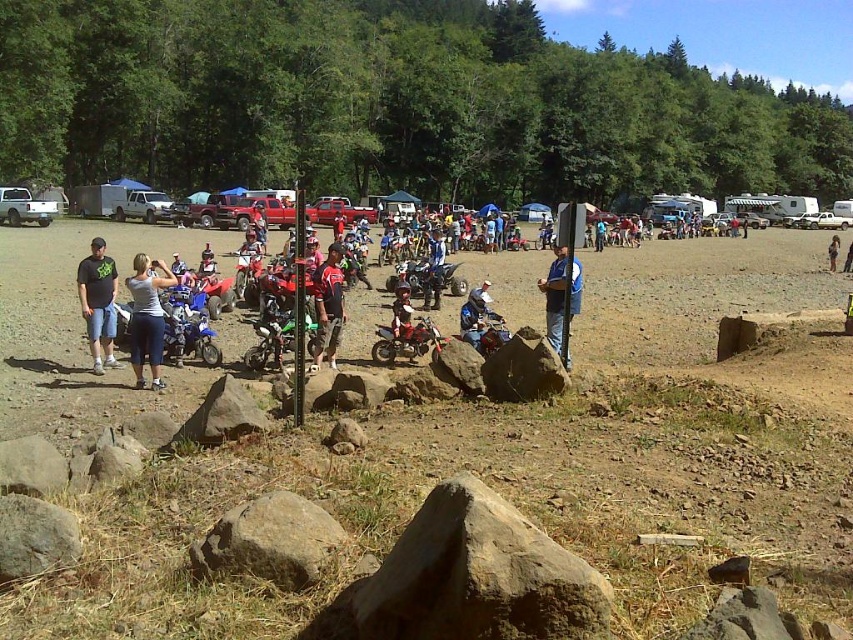
Is point (201, 307) farther from viewer compared to point (242, 244)?

No, it is not.

Does blue metallic motorcycle at center have a greater width compared to matte black motorcycle at center?

No, blue metallic motorcycle at center is not wider than matte black motorcycle at center.

Who is more distant from viewer, (207, 332) or (254, 289)?

The point (254, 289) is more distant.

At what (x,y) coordinates should I click in order to perform the action: click on blue metallic motorcycle at center. Please return your answer as a coordinate pair (x, y). Looking at the image, I should click on pos(187,328).

Based on the photo, is gray fabric shirt at center bigger than blue metallic motorcycle at center?

No, gray fabric shirt at center is not bigger than blue metallic motorcycle at center.

Can you confirm if gray fabric shirt at center is shorter than blue metallic motorcycle at center?

No, gray fabric shirt at center is not shorter than blue metallic motorcycle at center.

Find the location of a particular element. This screenshot has width=853, height=640. gray fabric shirt at center is located at coordinates (148, 317).

At what (x,y) coordinates should I click in order to perform the action: click on gray fabric shirt at center. Please return your answer as a coordinate pair (x, y). Looking at the image, I should click on (148, 317).

Does brown rough rock at center appear on the right side of matte black dirt bike at center?

Correct, you'll find brown rough rock at center to the right of matte black dirt bike at center.

Can you confirm if brown rough rock at center is positioned above matte black dirt bike at center?

Actually, brown rough rock at center is below matte black dirt bike at center.

This screenshot has height=640, width=853. Describe the element at coordinates (479, 577) in the screenshot. I see `brown rough rock at center` at that location.

This screenshot has height=640, width=853. Identify the location of brown rough rock at center. (479, 577).